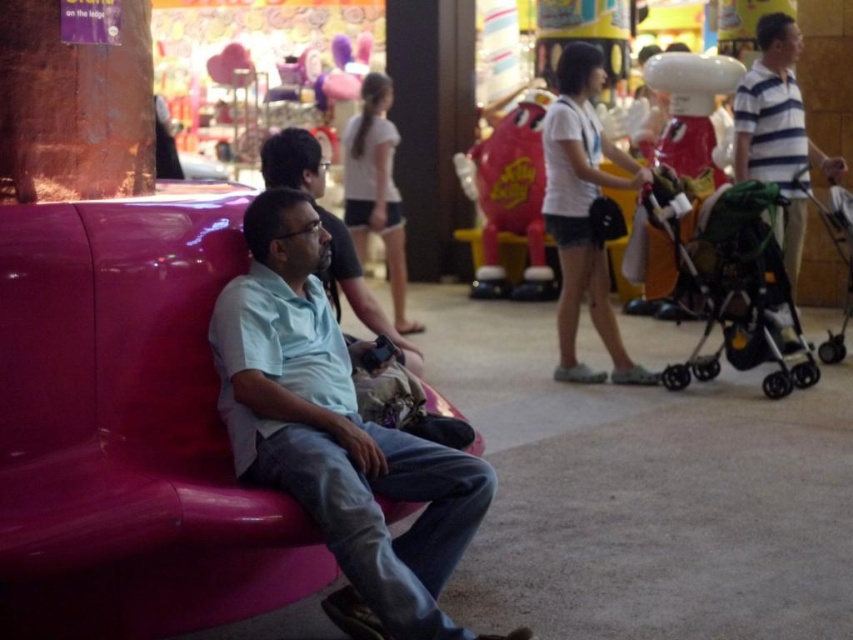
Based on the photo, can you confirm if white matte shirt at center is shorter than light blue shirt at center?

In fact, white matte shirt at center may be taller than light blue shirt at center.

Between point (613, 368) and point (416, 358), which one is positioned in front?

Point (416, 358) is more forward.

The width and height of the screenshot is (853, 640). Find the location of `white matte shirt at center`. white matte shirt at center is located at coordinates (583, 212).

Between point (283, 472) and point (350, 275), which one is positioned behind?

The point (350, 275) is more distant.

Consider the image. Is matte light blue shirt at center smaller than light blue shirt at center?

Incorrect, matte light blue shirt at center is not smaller in size than light blue shirt at center.

Which is behind, point (263, 481) or point (381, 320)?

Positioned behind is point (381, 320).

Find the location of a particular element. Image resolution: width=853 pixels, height=640 pixels. matte light blue shirt at center is located at coordinates click(335, 435).

Is matte light blue shirt at center to the right of white matte shirt at center from the viewer's perspective?

No, matte light blue shirt at center is not to the right of white matte shirt at center.

Image resolution: width=853 pixels, height=640 pixels. What do you see at coordinates (335, 435) in the screenshot? I see `matte light blue shirt at center` at bounding box center [335, 435].

Image resolution: width=853 pixels, height=640 pixels. Find the location of `matte light blue shirt at center`. matte light blue shirt at center is located at coordinates (335, 435).